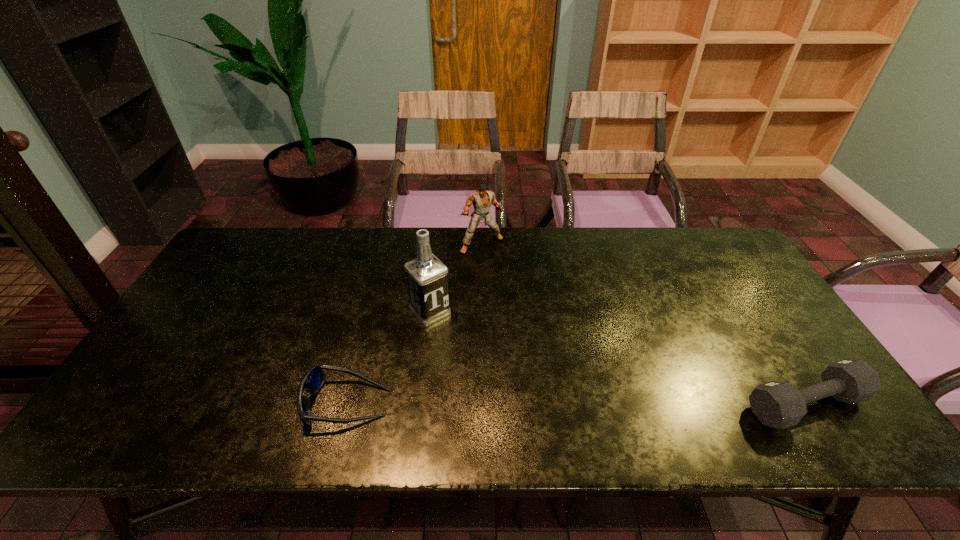
This screenshot has height=540, width=960. Find the location of `the leftmost object`. the leftmost object is located at coordinates (x=313, y=379).

You are a GUI agent. You are given a task and a screenshot of the screen. Output one action in this format:
    pyautogui.click(x=<x>, y=<y>)
    Task: Click on the sunglasses
    The width and height of the screenshot is (960, 540).
    Given the screenshot: What is the action you would take?
    pyautogui.click(x=313, y=379)

You are a GUI agent. You are given a task and a screenshot of the screen. Output one action in this format:
    pyautogui.click(x=<x>, y=<y>)
    Task: Click on the dumbbell
    Image resolution: width=960 pixels, height=540 pixels.
    Given the screenshot: What is the action you would take?
    pyautogui.click(x=780, y=405)

I want to click on the rightmost object, so click(780, 405).

Locate an element on the screen. the third nearest object is located at coordinates (427, 276).

Find the location of a particular element. This screenshot has width=960, height=540. vodka is located at coordinates (427, 276).

In order to click on puncher in this screenshot , I will do `click(481, 199)`.

Locate an element on the screen. The width and height of the screenshot is (960, 540). the farthest object is located at coordinates (481, 199).

Image resolution: width=960 pixels, height=540 pixels. Identify the location of blank space located on the front-facing side of the shortest object. (237, 403).

The image size is (960, 540). In order to click on free space located on the front-facing side of the shortest object in this screenshot , I will do (250, 403).